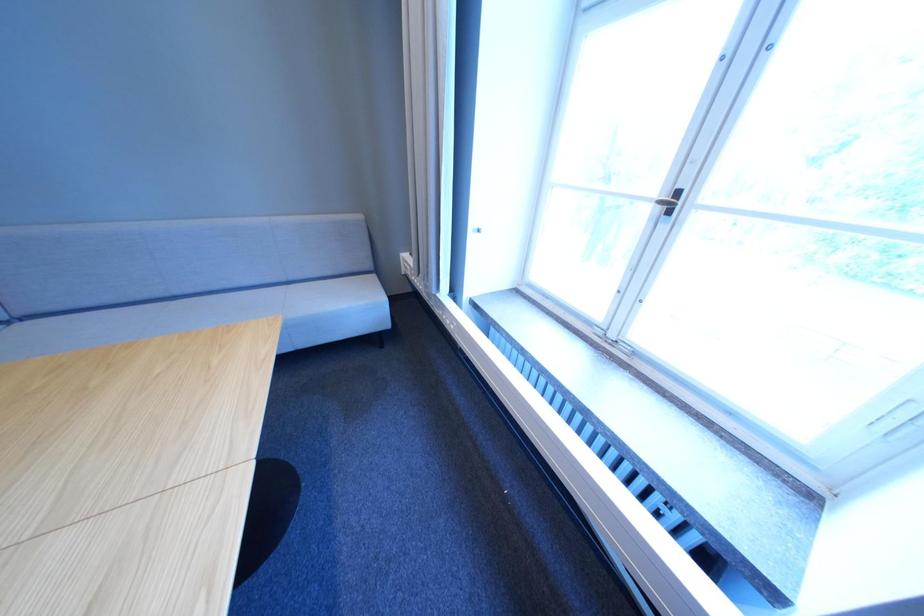
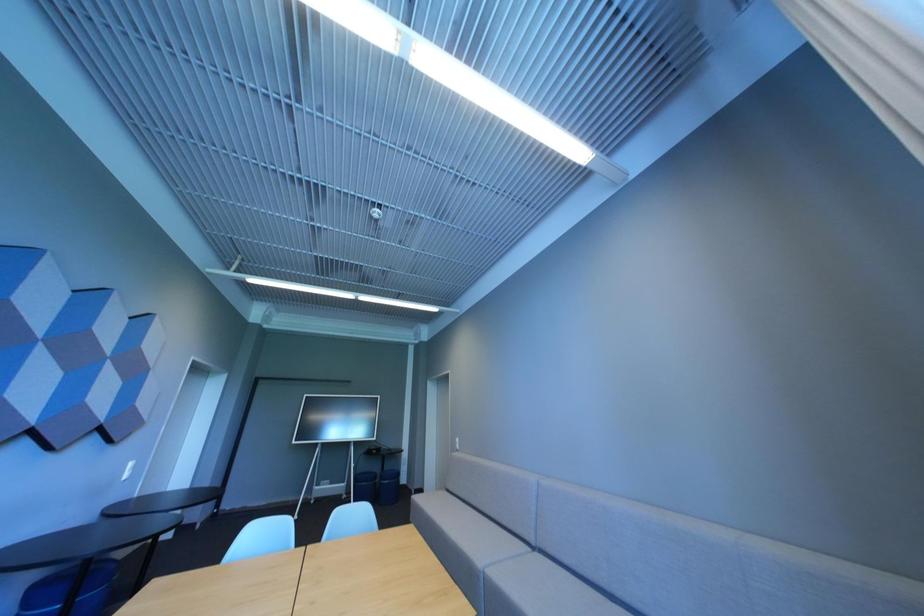
The first image is from the beginning of the video and the second image is from the end. How did the camera likely rotate when shooting the video?

The rotation direction of the camera is left-up.